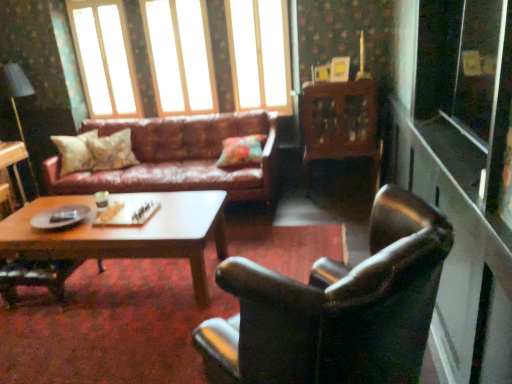
This screenshot has height=384, width=512. What are the coordinates of `vacant space situated on the left part of wooden cabinet at center` in the screenshot? It's located at (297, 204).